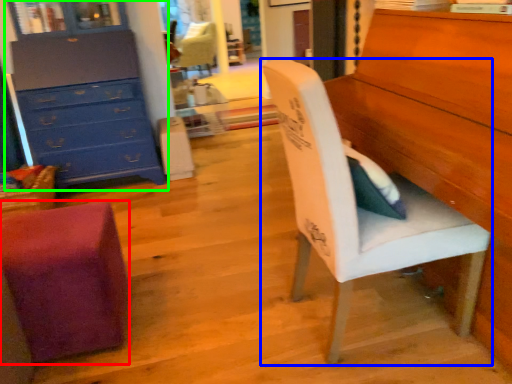
Question: Estimate the real-world distances between objects in this image. Which object is farther from chair (highlighted by a red box), chair (highlighted by a blue box) or chest of drawers (highlighted by a green box)?

Choices:
 (A) chair
 (B) chest of drawers

Answer: (B)